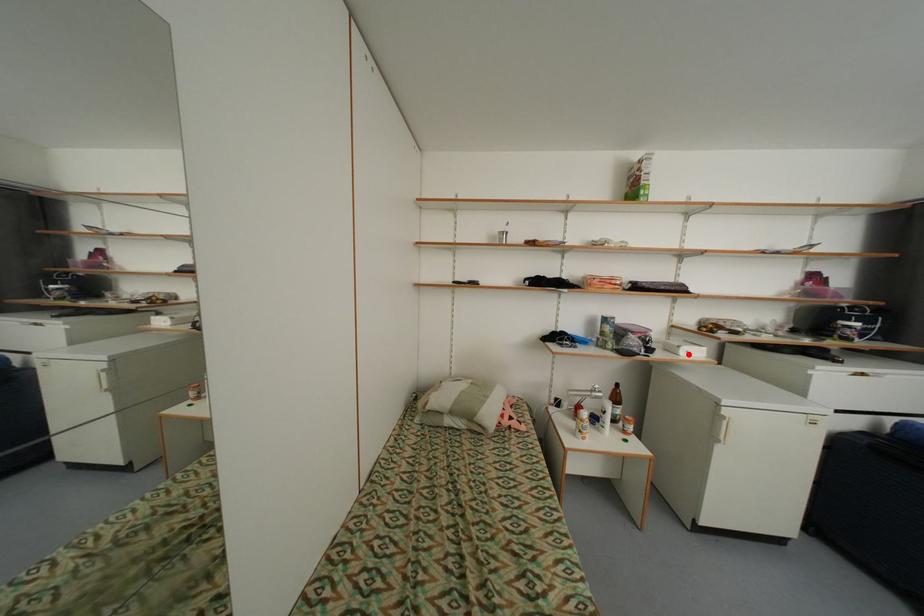
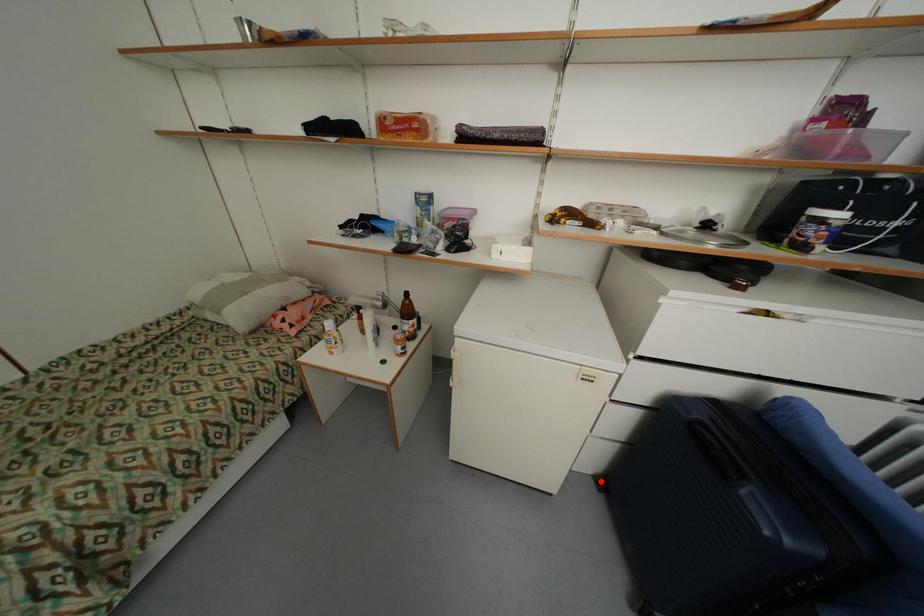
I am providing you with two images of the same scene from different viewpoints. A red point is marked on the first image and another point is marked on the second image. Is the red point in image1 aligned with the point shown in image2?

No